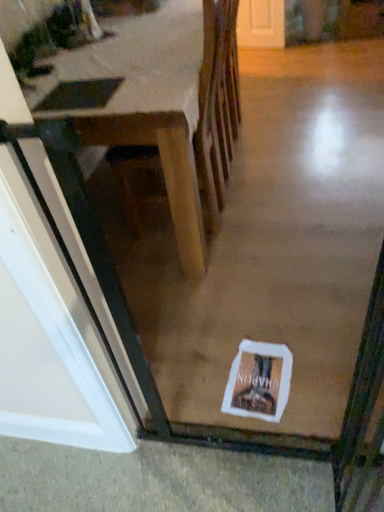
Measure the distance between point [181,177] and camera.

5.10 feet.

This screenshot has width=384, height=512. What do you see at coordinates (160, 116) in the screenshot? I see `wooden table at center` at bounding box center [160, 116].

The width and height of the screenshot is (384, 512). I want to click on wooden table at center, so click(x=160, y=116).

What is the approximate height of wooden table at center?

3.54 feet.

Describe the element at coordinates (259, 381) in the screenshot. This screenshot has height=512, width=384. I see `white paper postcard at center` at that location.

Find the location of a particular element. The height and width of the screenshot is (512, 384). white paper postcard at center is located at coordinates (x=259, y=381).

Image resolution: width=384 pixels, height=512 pixels. What are the coordinates of `wooden table at center` in the screenshot? It's located at (160, 116).

Considering the positions of objects wooden table at center and white paper postcard at center in the image provided, who is more to the right, wooden table at center or white paper postcard at center?

white paper postcard at center.

Which object is closer to the camera, wooden table at center or white paper postcard at center?

Positioned in front is wooden table at center.

Is point (101, 54) closer to camera compared to point (248, 342)?

No, it is not.

From the image's perspective, is wooden table at center above white paper postcard at center?

Yes, from the image's perspective, wooden table at center is on top of white paper postcard at center.

From a real-world perspective, is wooden table at center on top of white paper postcard at center?

Indeed, from a real-world perspective, wooden table at center stands above white paper postcard at center.

Considering the relative sizes of wooden table at center and white paper postcard at center in the image provided, is wooden table at center wider than white paper postcard at center?

Indeed, wooden table at center has a greater width compared to white paper postcard at center.

Is wooden table at center taller or shorter than white paper postcard at center?

Considering their sizes, wooden table at center has more height than white paper postcard at center.

In the scene shown: Does wooden table at center have a smaller size compared to white paper postcard at center?

Actually, wooden table at center might be larger than white paper postcard at center.

Is wooden table at center surrounding white paper postcard at center?

No, white paper postcard at center is not inside wooden table at center.

Would you consider wooden table at center to be distant from white paper postcard at center?

No, wooden table at center is not far away from white paper postcard at center.

Consider the image. Is wooden table at center oriented away from white paper postcard at center?

wooden table at center does not have its back to white paper postcard at center.

How different are the orientations of wooden table at center and white paper postcard at center in degrees?

The facing directions of wooden table at center and white paper postcard at center are 85.2 degrees apart.

Measure the distance between wooden table at center and white paper postcard at center.

wooden table at center and white paper postcard at center are 39.21 inches apart from each other.

Identify the location of postcard on the right of wooden table at center. (259, 381).

Between white paper postcard at center and wooden table at center, which one appears on the right side from the viewer's perspective?

white paper postcard at center is more to the right.

In the image, is white paper postcard at center positioned in front of or behind wooden table at center?

Clearly, white paper postcard at center is behind wooden table at center.

Which is nearer, (237,415) or (115,154)?

The point (237,415) is more forward.

From the image's perspective, is white paper postcard at center above wooden table at center?

Actually, white paper postcard at center appears below wooden table at center in the image.

From a real-world perspective, which is physically above, white paper postcard at center or wooden table at center?

wooden table at center is physically above.

Can you confirm if white paper postcard at center is thinner than wooden table at center?

Yes.

Does white paper postcard at center have a lesser height compared to wooden table at center?

Yes, white paper postcard at center is shorter than wooden table at center.

In terms of size, does white paper postcard at center appear bigger or smaller than wooden table at center?

Clearly, white paper postcard at center is smaller in size than wooden table at center.

Which is correct: white paper postcard at center is inside wooden table at center, or outside of it?

white paper postcard at center is not enclosed by wooden table at center.

Is white paper postcard at center not near wooden table at center?

No, white paper postcard at center is not far away from wooden table at center.

Consider the image. Is white paper postcard at center facing towards wooden table at center?

No, white paper postcard at center is not oriented towards wooden table at center.

At what (x,y) coordinates should I click in order to perform the action: click on postcard behind the wooden table at center. Please return your answer as a coordinate pair (x, y). Looking at the image, I should click on (259, 381).

The width and height of the screenshot is (384, 512). What are the coordinates of `table that is above the white paper postcard at center (from a real-world perspective)` in the screenshot? It's located at (160, 116).

In the image, there is a white paper postcard at center. Find the location of `table above it (from the image's perspective)`. table above it (from the image's perspective) is located at coordinates (160, 116).